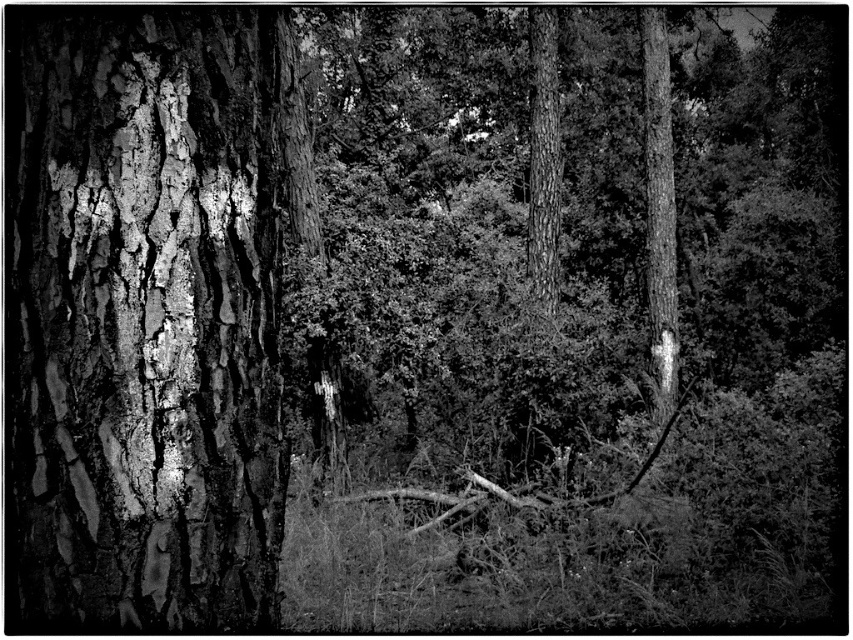
Is point (126, 227) positioned before point (641, 29)?

Yes, point (126, 227) is in front of point (641, 29).

What do you see at coordinates (146, 317) in the screenshot? I see `cracked bark tree trunk at left` at bounding box center [146, 317].

Locate an element on the screen. cracked bark tree trunk at left is located at coordinates (146, 317).